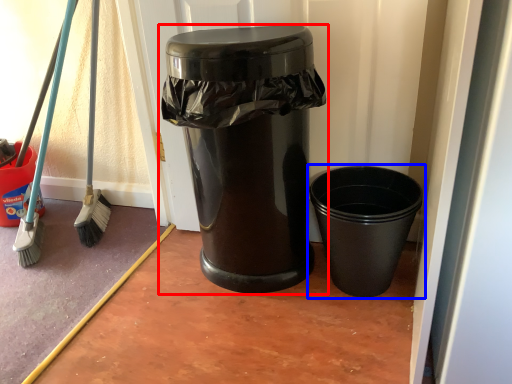
Question: Which object appears farthest to the camera in this image, waste container (highlighted by a red box) or waste container (highlighted by a blue box)?

Choices:
 (A) waste container
 (B) waste container

Answer: (B)